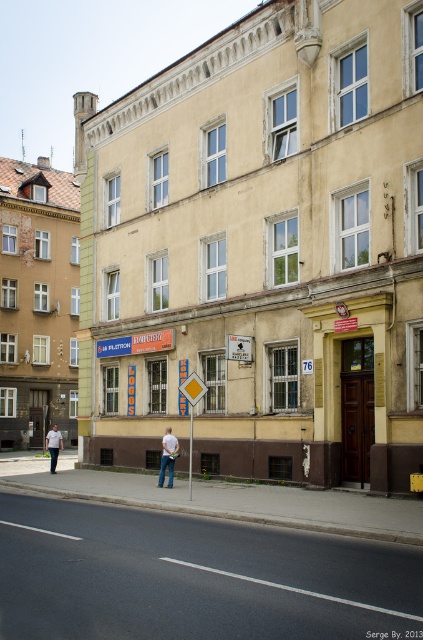
Is point (165, 429) more distant than point (52, 472)?

No, (165, 429) is in front of (52, 472).

This screenshot has height=640, width=423. What do you see at coordinates (167, 456) in the screenshot? I see `white fabric shirt at center` at bounding box center [167, 456].

Identify the location of white fabric shirt at center. (167, 456).

Which is below, white fabric shirt at center or metallic rectangular sign at center?

Positioned lower is white fabric shirt at center.

Which of these two, white fabric shirt at center or metallic rectangular sign at center, stands shorter?

metallic rectangular sign at center is shorter.

The height and width of the screenshot is (640, 423). I want to click on white fabric shirt at center, so click(x=167, y=456).

Can you confirm if metallic rectangular sign at center is positioned to the right of white cotton shirt at center?

Yes, metallic rectangular sign at center is to the right of white cotton shirt at center.

Who is positioned more to the right, metallic rectangular sign at center or white cotton shirt at center?

metallic rectangular sign at center

Between point (241, 349) and point (54, 465), which one is positioned behind?

Positioned behind is point (54, 465).

The width and height of the screenshot is (423, 640). In order to click on metallic rectangular sign at center in this screenshot , I will do `click(238, 348)`.